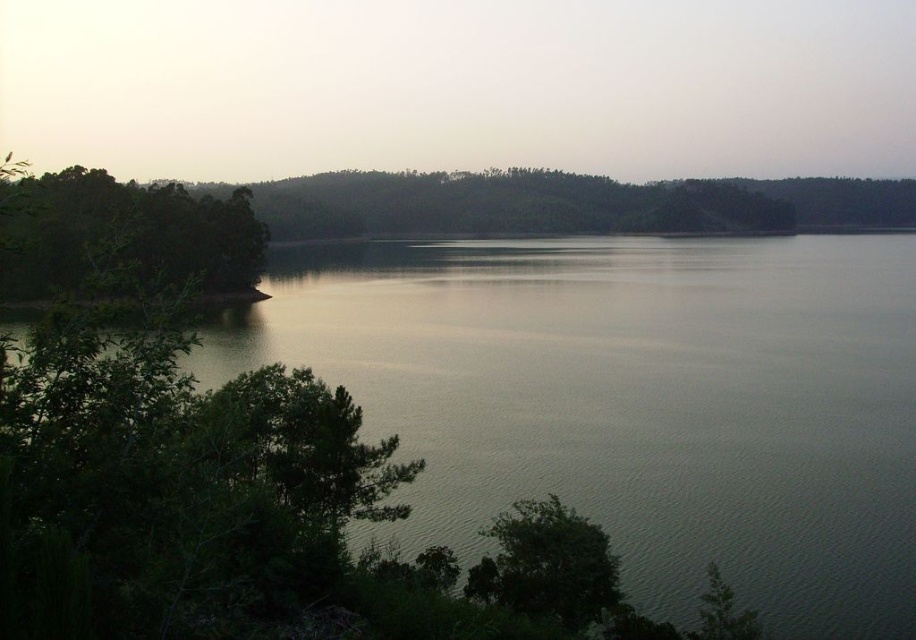
You are standing on the lakeside path and want to take a photo of the greenish water at center and the green leafy trees at left. Which object should you focus on first if you want both to be in clear focus?

The greenish water at center is positioned under green leafy trees at left, so you should focus on the green leafy trees at left first since they are closer to you and the water is behind them.

You are standing on the lakeside and want to take a photo of the green leafy trees at left. If you are 1.7 meters tall, can you step forward to get closer to the trees without moving your feet? Explain why based on the distance between you and the trees.

The distance between you and the green leafy trees at left is 7.29 meters. Since you are only 1.7 meters tall, stepping forward while keeping your feet in place isn not possible because your height doesn not affect your ability to move closer. You can move forward towards the trees as long as there is space between you and them.